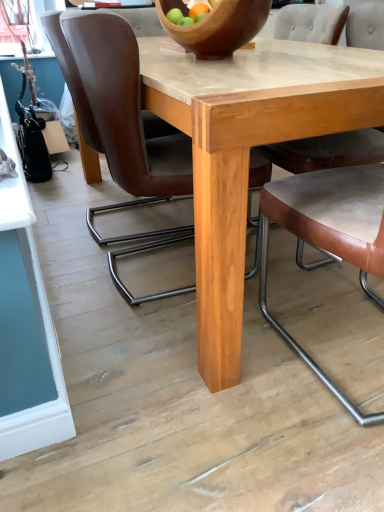
Question: Is brown leather chair at center, arranged as the third chair when viewed from the left, oriented away from brown leather chair at center, marked as the 4th chair in a left-to-right arrangement?

Choices:
 (A) no
 (B) yes

Answer: (A)

Question: Is brown leather chair at center, which is counted as the second chair, starting from the right, not inside brown leather chair at center, acting as the 1th chair starting from the right?

Choices:
 (A) yes
 (B) no

Answer: (A)

Question: Does brown leather chair at center, arranged as the third chair when viewed from the left, have a greater width compared to brown leather chair at center, marked as the 4th chair in a left-to-right arrangement?

Choices:
 (A) yes
 (B) no

Answer: (B)

Question: Considering the relative sizes of brown leather chair at center, arranged as the third chair when viewed from the left, and brown leather chair at center, marked as the 4th chair in a left-to-right arrangement, in the image provided, is brown leather chair at center, arranged as the third chair when viewed from the left, taller than brown leather chair at center, marked as the 4th chair in a left-to-right arrangement,?

Choices:
 (A) yes
 (B) no

Answer: (B)

Question: Can you confirm if brown leather chair at center, arranged as the third chair when viewed from the left, is positioned to the left of brown leather chair at center, acting as the 1th chair starting from the right?

Choices:
 (A) yes
 (B) no

Answer: (A)

Question: Considering the relative sizes of brown leather chair at center, which is counted as the second chair, starting from the right, and brown leather chair at center, acting as the 1th chair starting from the right, in the image provided, is brown leather chair at center, which is counted as the second chair, starting from the right, shorter than brown leather chair at center, acting as the 1th chair starting from the right,?

Choices:
 (A) no
 (B) yes

Answer: (B)

Question: Considering the relative sizes of natural wood table at center and brown leather chair at center, the 1th chair in the left-to-right sequence, in the image provided, is natural wood table at center wider than brown leather chair at center, the 1th chair in the left-to-right sequence,?

Choices:
 (A) yes
 (B) no

Answer: (A)

Question: Considering the relative sizes of natural wood table at center and brown leather chair at center, the 1th chair in the left-to-right sequence, in the image provided, is natural wood table at center shorter than brown leather chair at center, the 1th chair in the left-to-right sequence,?

Choices:
 (A) yes
 (B) no

Answer: (A)

Question: Is natural wood table at center aimed at brown leather chair at center, which ranks as the fourth chair in right-to-left order?

Choices:
 (A) no
 (B) yes

Answer: (B)

Question: Can you confirm if natural wood table at center is thinner than brown leather chair at center, the 1th chair in the left-to-right sequence?

Choices:
 (A) no
 (B) yes

Answer: (A)

Question: From the image's perspective, does natural wood table at center appear lower than brown leather chair at center, which ranks as the fourth chair in right-to-left order?

Choices:
 (A) yes
 (B) no

Answer: (A)

Question: Is brown leather chair at center, which ranks as the fourth chair in right-to-left order, surrounded by natural wood table at center?

Choices:
 (A) no
 (B) yes

Answer: (B)

Question: Is brown leather chair at center, acting as the 2th chair starting from the left, far away from brown leather chair at center, which ranks as the fourth chair in right-to-left order?

Choices:
 (A) no
 (B) yes

Answer: (A)